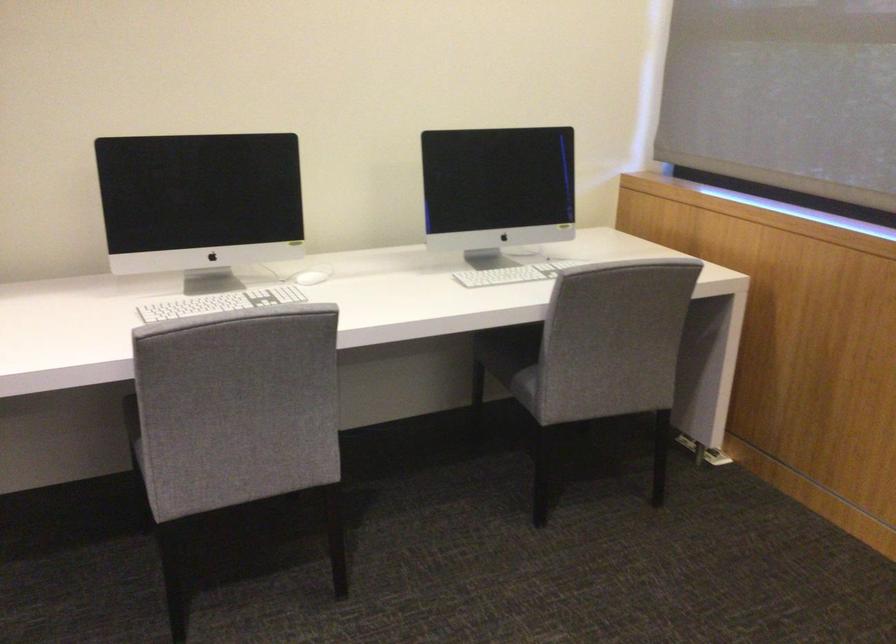
How did the camera likely rotate?

The camera's rotation is toward left-up.